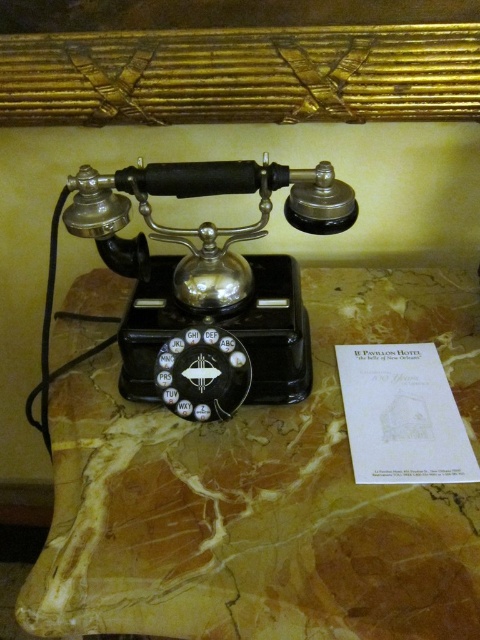
You are trying to place a small decorative paperweight on the surface between the marble at center and the black polished rotary phone at center. Given that the marble is larger than the phone, where should you place the paperweight to ensure it fits without overlapping either object?

Since the marble at center is larger than the black polished rotary phone at center, you should place the paperweight in the area between them where there is sufficient space, ensuring it doesn not overlap either object by positioning it closer to the smaller black polished rotary phone at center.

You are trying to reach the black polished rotary phone at center to make a call. However, there is a marble at center in your way. Can you easily reach the phone without moving the marble?

The marble at center is closer to the viewer than the black polished rotary phone at center, so the marble is blocking the path to the phone. You would need to move the marble to access the phone.